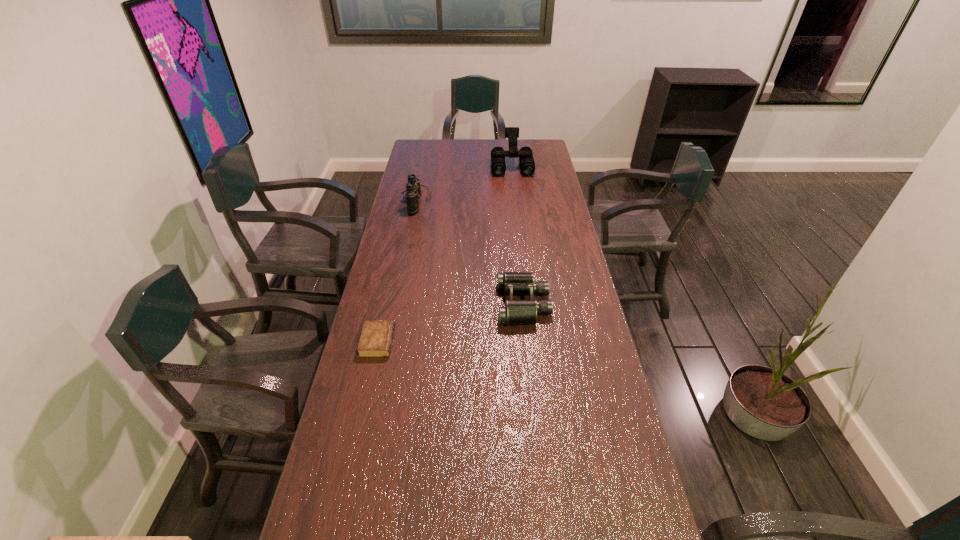
What are the coordinates of `vacant space at the far left corner of the desktop` in the screenshot? It's located at (429, 147).

Locate an element on the screen. vacant area that lies between the farthest binoculars and the second shortest binoculars is located at coordinates (464, 183).

Identify the location of vacant area that lies between the second nearest binoculars and the shortest binoculars. (469, 252).

Find the location of a particular element. free spot between the second farthest object and the shortest object is located at coordinates (396, 271).

Identify the location of free space between the tallest object and the diary. Image resolution: width=960 pixels, height=540 pixels. (445, 254).

You are a GUI agent. You are given a task and a screenshot of the screen. Output one action in this format:
    pyautogui.click(x=<x>, y=<y>)
    Task: Click on the vacant region between the tallest object and the nearest binoculars
    The height and width of the screenshot is (540, 960).
    Given the screenshot: What is the action you would take?
    pyautogui.click(x=517, y=235)

Identify the location of vacant area that lies between the second nearest binoculars and the shortest binoculars. (469, 252).

In order to click on free space between the shortest object and the third shortest object in this screenshot , I will do `click(396, 271)`.

The width and height of the screenshot is (960, 540). I want to click on empty location between the tallest object and the nearest binoculars, so click(517, 235).

The width and height of the screenshot is (960, 540). I want to click on empty space that is in between the diary and the shortest binoculars, so click(451, 323).